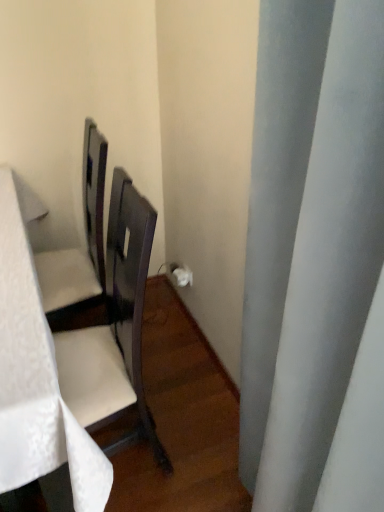
Question: Based on their sizes in the image, would you say white fabric table at left is bigger or smaller than white matte curtain at right?

Choices:
 (A) small
 (B) big

Answer: (B)

Question: From a real-world perspective, is white fabric table at left above or below white matte curtain at right?

Choices:
 (A) below
 (B) above

Answer: (A)

Question: Does point (18, 372) appear closer or farther from the camera than point (332, 355)?

Choices:
 (A) closer
 (B) farther

Answer: (B)

Question: Visually, is white matte curtain at right positioned to the left or to the right of white fabric table at left?

Choices:
 (A) right
 (B) left

Answer: (A)

Question: Do you think white matte curtain at right is within white fabric table at left, or outside of it?

Choices:
 (A) outside
 (B) inside

Answer: (A)

Question: Looking at their shapes, would you say white matte curtain at right is wider or thinner than white fabric table at left?

Choices:
 (A) thin
 (B) wide

Answer: (A)

Question: From the image's perspective, is white matte curtain at right above or below white fabric table at left?

Choices:
 (A) above
 (B) below

Answer: (A)